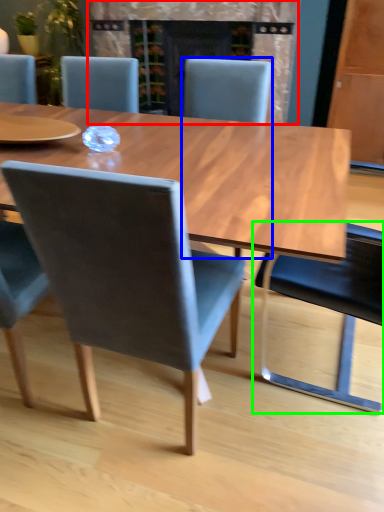
Question: Which is nearer to the fireplace (highlighted by a red box)? chair (highlighted by a blue box) or chair (highlighted by a green box).

Choices:
 (A) chair
 (B) chair

Answer: (A)